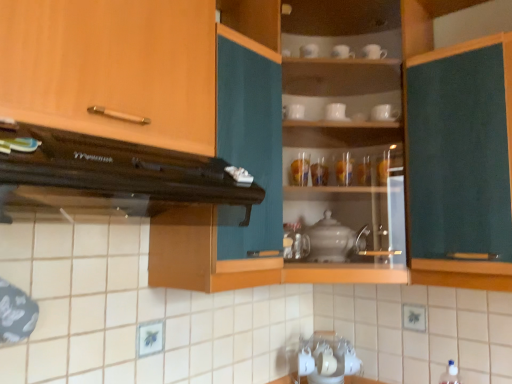
Question: From a real-world perspective, is white glossy cup at upper center, which is the sixth tableware from right to left, physically located above or below white ceramic cup at upper center, marked as the 1th tableware in a right-to-left arrangement?

Choices:
 (A) below
 (B) above

Answer: (A)

Question: Is white glossy cup at upper center, which is the first tableware from left to right, taller or shorter than white ceramic cup at upper center, marked as the 1th tableware in a right-to-left arrangement?

Choices:
 (A) short
 (B) tall

Answer: (A)

Question: Which object is the closest to the green felt board at right, arranged as the first cabinetry when viewed from the right?

Choices:
 (A) translucent glass vase at upper center, which is the second tableware from right to left
 (B) translucent glass vase at center, the 2th tableware positioned from the left
 (C) satin silver teapot at center
 (D) translucent glass vase at upper center, positioned as the 3th tableware in left-to-right order
 (E) white glossy cup at upper center, which is counted as the fourth tableware, starting from the left

Answer: (E)

Question: Estimate the real-world distances between objects in this image. Which object is farther from the translucent glass vase at upper center, which is the second tableware from right to left?

Choices:
 (A) white glossy cup at upper center, which is counted as the fourth tableware, starting from the left
 (B) satin silver teapot at center
 (C) translucent glass vase at upper center, the 4th tableware positioned from the right
 (D) dark brown wood range hood at upper left
 (E) white glossy cup at upper center, which is the first tableware from left to right

Answer: (D)